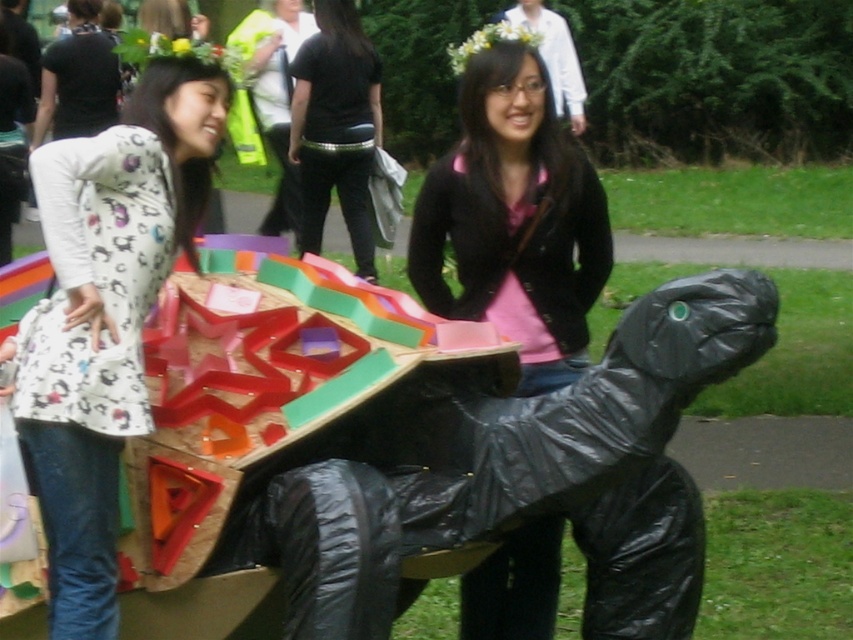
You are an artist trying to create a miniature version of the scene. You need to ensure the proportions between the matte black turtle at center and the black leather pants at center are accurate. Which object should be made smaller in your model?

The matte black turtle at center should be made smaller in the model since it is shorter than the black leather pants at center.

You are standing in the park and see the matte black turtle at center and the black leather pants at center. Which object is positioned more to the right side?

The matte black turtle at center is positioned more to the right side than the black leather pants at center.